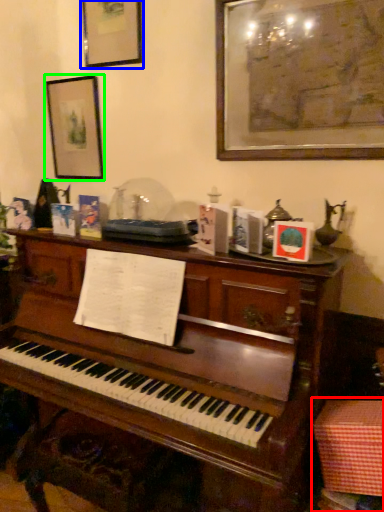
Question: Which object is positioned farthest from table (highlighted by a red box)? Select from picture frame (highlighted by a blue box) and picture frame (highlighted by a green box).

Choices:
 (A) picture frame
 (B) picture frame

Answer: (A)